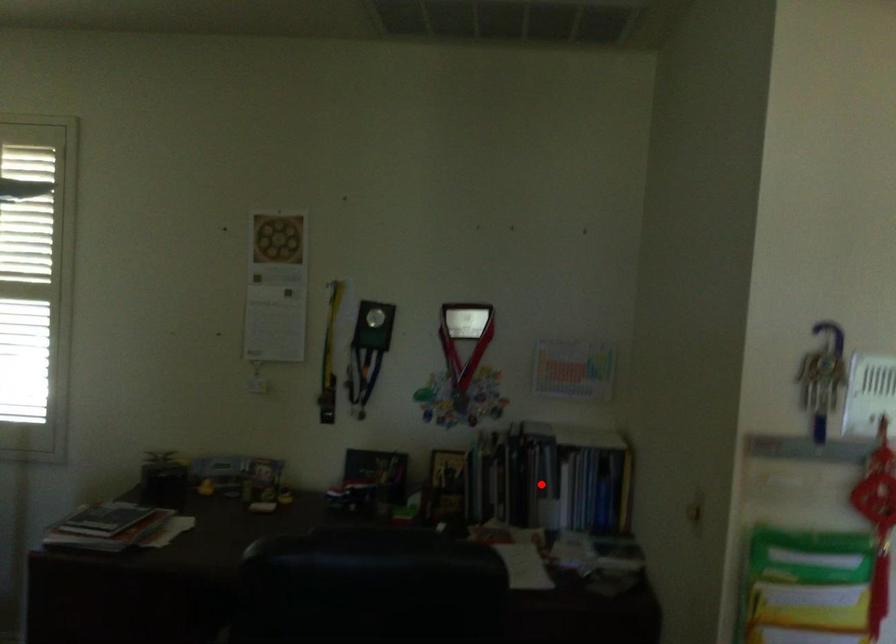
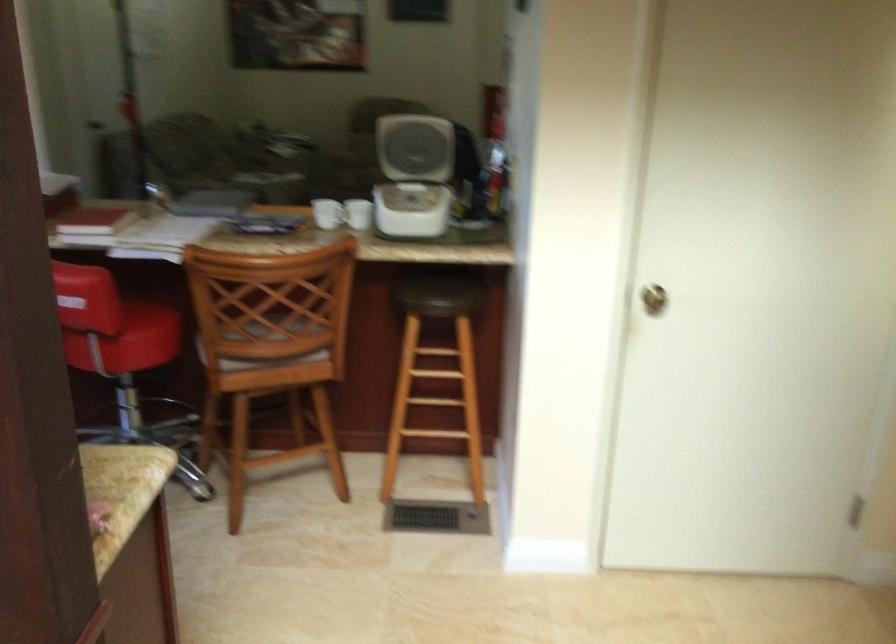
Question: I am providing you with two images of the same scene from different viewpoints. A red point is marked on the first image. Can you still see the location of the red point in image 2?

Choices:
 (A) Yes
 (B) No

Answer: (B)